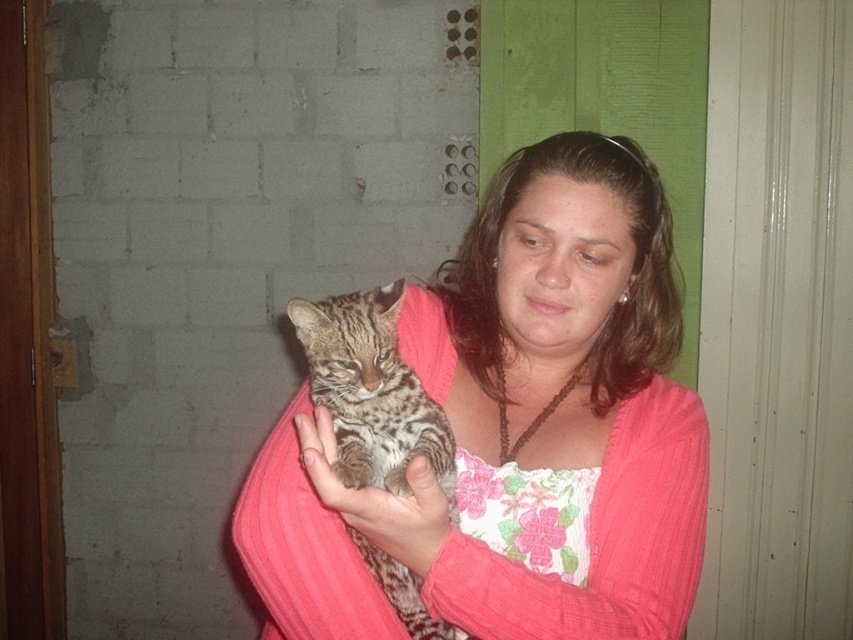
Does pink ribbed sweater at center appear under spotted fur cat at center?

Actually, pink ribbed sweater at center is above spotted fur cat at center.

What do you see at coordinates (515, 429) in the screenshot? I see `pink ribbed sweater at center` at bounding box center [515, 429].

Where is `pink ribbed sweater at center`? The image size is (853, 640). pink ribbed sweater at center is located at coordinates (515, 429).

Who is higher up, pink ribbed sweater at center or soft fur paw at center?

pink ribbed sweater at center is higher up.

Between pink ribbed sweater at center and soft fur paw at center, which one appears on the left side from the viewer's perspective?

soft fur paw at center

The height and width of the screenshot is (640, 853). Find the location of `pink ribbed sweater at center`. pink ribbed sweater at center is located at coordinates (515, 429).

Identify the location of pink ribbed sweater at center. (515, 429).

Between fluffy fur cat at center and soft fur paw at center, which one has less height?

Standing shorter between the two is soft fur paw at center.

Can you confirm if fluffy fur cat at center is wider than soft fur paw at center?

Yes, fluffy fur cat at center is wider than soft fur paw at center.

Is point (656, 628) farther from camera compared to point (322, 456)?

Yes, it is behind point (322, 456).

The width and height of the screenshot is (853, 640). What are the coordinates of `fluffy fur cat at center` in the screenshot? It's located at point(589,528).